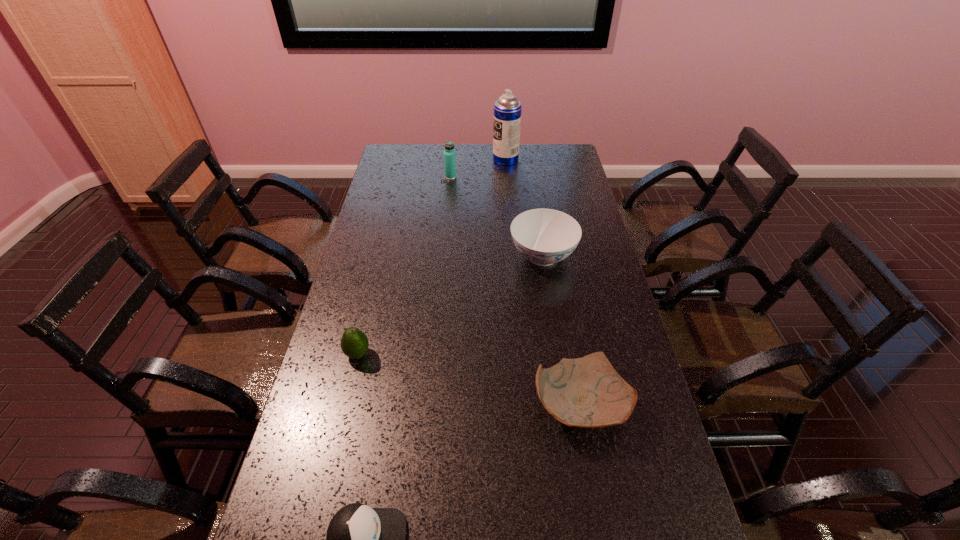
I want to click on aerosol can, so pos(507,110).

Image resolution: width=960 pixels, height=540 pixels. I want to click on the farthest object, so click(x=507, y=110).

Locate an element on the screen. Image resolution: width=960 pixels, height=540 pixels. the second farthest object is located at coordinates (449, 154).

Find the location of a particular element. The width and height of the screenshot is (960, 540). thermos bottle is located at coordinates (449, 154).

Where is `chinaware`? The height and width of the screenshot is (540, 960). chinaware is located at coordinates coord(544,236).

Locate an element on the screen. Image resolution: width=960 pixels, height=540 pixels. the third nearest object is located at coordinates (354, 343).

The width and height of the screenshot is (960, 540). I want to click on the second nearest object, so click(x=587, y=392).

What are the coordinates of `free point located on the label side of the farthest object` in the screenshot? It's located at (456, 159).

The height and width of the screenshot is (540, 960). What are the coordinates of `blank space located 0.270m on the label side of the farthest object` in the screenshot? It's located at (434, 159).

You are a GUI agent. You are given a task and a screenshot of the screen. Output one action in this format:
    pyautogui.click(x=<x>, y=<y>)
    Task: Click on the free location located 0.160m on the label side of the farthest object
    This screenshot has height=540, width=960.
    Given the screenshot: What is the action you would take?
    pyautogui.click(x=458, y=159)